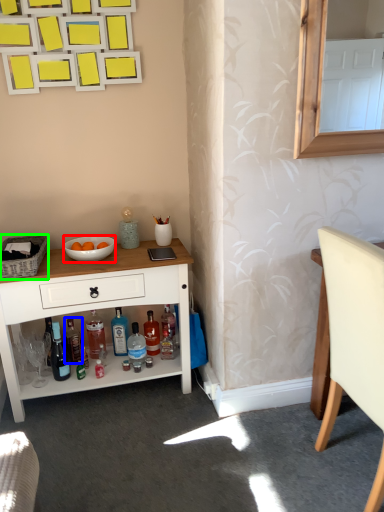
Question: Which object is positioned closest to bowl (highlighted by a red box)? Select from bottle (highlighted by a blue box) and picnic basket (highlighted by a green box).

Choices:
 (A) bottle
 (B) picnic basket

Answer: (B)